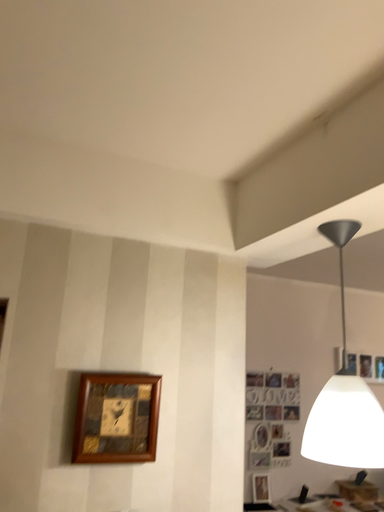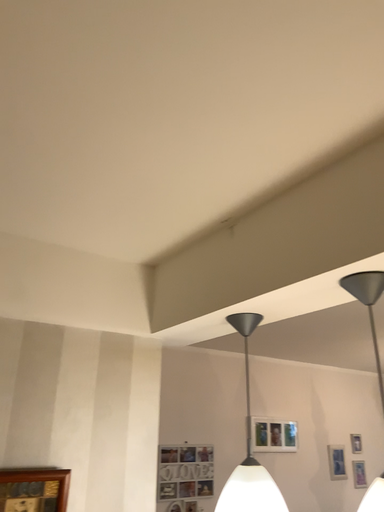
Question: Which way did the camera rotate in the video?

Choices:
 (A) rotated right
 (B) rotated left

Answer: (A)